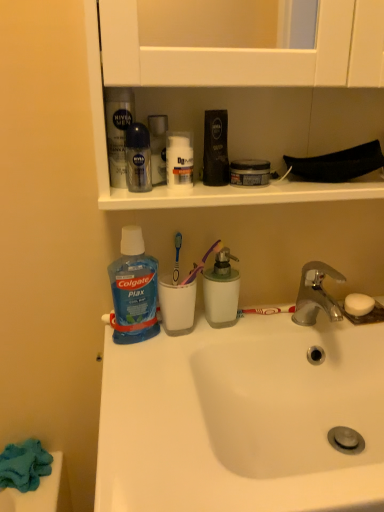
Locate an element on the screen. The image size is (384, 512). free spot to the left of white plastic toothbrush at sink, which ranks as the 1th toothbrush in right-to-left order is located at coordinates (195, 341).